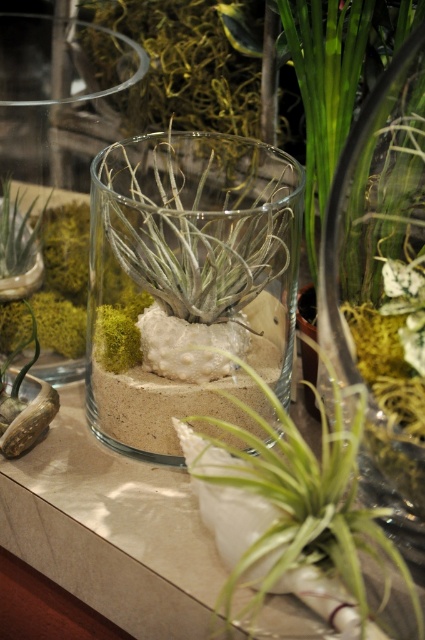
Does clear glass vase at center have a smaller size compared to green moss at left?

Actually, clear glass vase at center might be larger than green moss at left.

Does point (91, 193) come closer to viewer compared to point (10, 188)?

Yes, point (91, 193) is in front of point (10, 188).

Does point (193, 141) come closer to viewer compared to point (28, 221)?

No, it is not.

The image size is (425, 640). Identify the location of clear glass vase at center. (192, 282).

Does clear glass vase at center have a lesser width compared to green leafy plant at center?

No, clear glass vase at center is not thinner than green leafy plant at center.

Is point (153, 440) positioned after point (339, 525)?

Yes, point (153, 440) is farther from viewer.

This screenshot has height=640, width=425. What do you see at coordinates (192, 282) in the screenshot? I see `clear glass vase at center` at bounding box center [192, 282].

Where is `clear glass vase at center`? Image resolution: width=425 pixels, height=640 pixels. clear glass vase at center is located at coordinates (192, 282).

Between green leafy plant at center and green moss at left, which one has more height?

green leafy plant at center is taller.

This screenshot has width=425, height=640. I want to click on green leafy plant at center, so click(291, 515).

Is point (215, 456) positioned before point (25, 221)?

Yes, point (215, 456) is in front of point (25, 221).

In order to click on green leafy plant at center in this screenshot , I will do `click(291, 515)`.